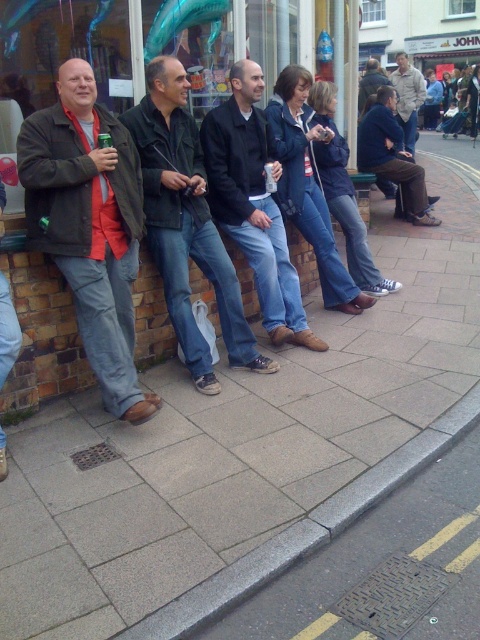
You are a photographer standing in front of the scene. You need to capture a photo where both the matte black jacket at left and the dark green jacket at center are visible. Based on their positions, which jacket should you focus on first to ensure both are in frame?

The matte black jacket at left is below the dark green jacket at center, so you should focus on the dark green jacket at center first to ensure both are in frame.

You are a photographer trying to capture a group photo of the dark green jacket at center and the dark brown leather jacket at center. Since you want both jackets to appear equally sized in the photo, should you position yourself closer to the taller jacket or the shorter one?

The dark green jacket at center is taller than the dark brown leather jacket at center. To make both jackets appear equally sized in the photo, you should position yourself closer to the shorter jacket, the dark brown leather jacket at center. This way, the shorter jacket will appear larger in the frame, balancing its size with the taller jacket.

You are a tailor measuring jackets for alterations. You need to determine which jacket requires more fabric to adjust the sleeves. Based on the image, which jacket between the matte black jacket at left and the dark green jacket at center needs more fabric?

The dark green jacket at center requires more fabric for sleeve adjustments since it is larger than the matte black jacket at left.